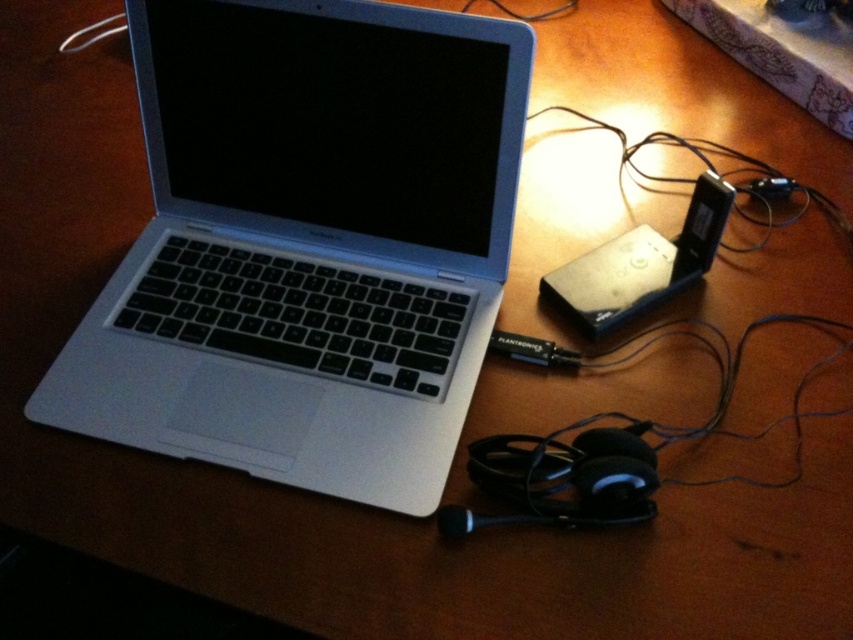
Can you confirm if silver metallic laptop at center is smaller than satin black ipod at center right?

Incorrect, silver metallic laptop at center is not smaller in size than satin black ipod at center right.

Can you confirm if silver metallic laptop at center is positioned to the left of satin black ipod at center right?

Yes, silver metallic laptop at center is to the left of satin black ipod at center right.

The width and height of the screenshot is (853, 640). In order to click on silver metallic laptop at center in this screenshot , I will do `click(306, 243)`.

Where is `silver metallic laptop at center`? Image resolution: width=853 pixels, height=640 pixels. silver metallic laptop at center is located at coordinates (306, 243).

Which of these two, silver metallic laptop at center or black plastic ipod at center-right, stands shorter?

black plastic ipod at center-right

From the picture: Who is lower down, silver metallic laptop at center or black plastic ipod at center-right?

Positioned lower is silver metallic laptop at center.

What do you see at coordinates (306, 243) in the screenshot?
I see `silver metallic laptop at center` at bounding box center [306, 243].

Locate an element on the screen. Image resolution: width=853 pixels, height=640 pixels. silver metallic laptop at center is located at coordinates (306, 243).

Does point (602, 248) lie behind point (689, 259)?

Yes, point (602, 248) is behind point (689, 259).

Is point (676, 284) in front of point (709, 243)?

Yes, it is in front of point (709, 243).

This screenshot has width=853, height=640. Describe the element at coordinates (641, 262) in the screenshot. I see `satin black ipod at center right` at that location.

What are the coordinates of `satin black ipod at center right` in the screenshot? It's located at (641, 262).